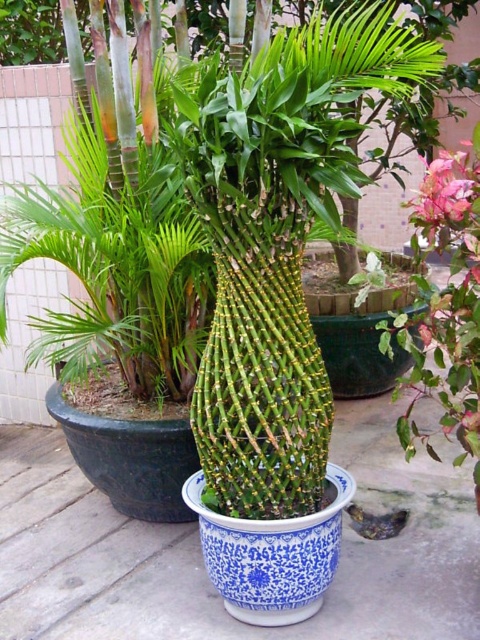
You are arranging flowers for a party and need to place the blue porcelain vase at center and the pink matte flower at upper right. According to the scene, which object is located to the left of the other?

The blue porcelain vase at center is positioned on the left side of pink matte flower at upper right.